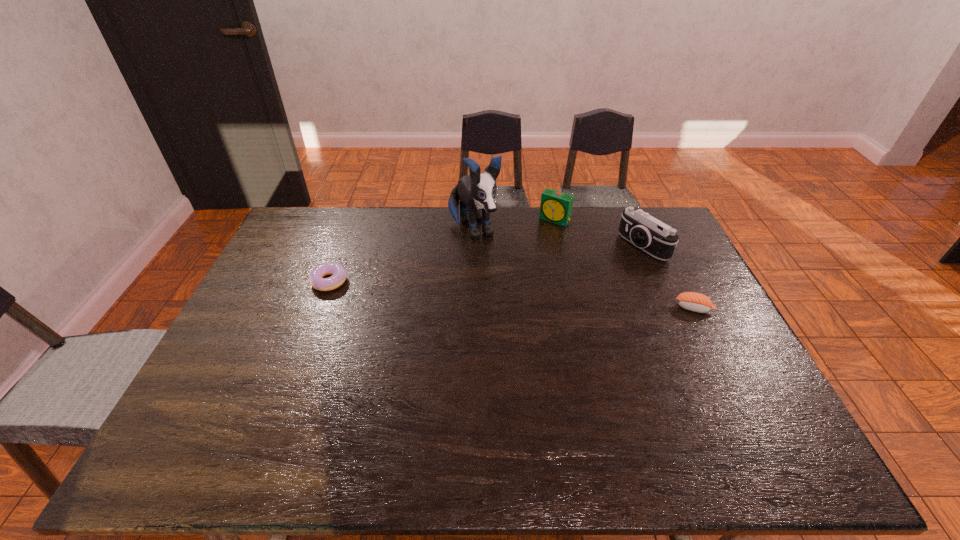
The height and width of the screenshot is (540, 960). I want to click on puppy at the far edge, so [x=477, y=191].

The height and width of the screenshot is (540, 960). What are the coordinates of `camera that is at the far edge` in the screenshot? It's located at (656, 238).

I want to click on alarm clock present at the far edge, so click(x=555, y=206).

This screenshot has width=960, height=540. Find the location of `sushi situated at the right edge`. sushi situated at the right edge is located at coordinates (693, 301).

Image resolution: width=960 pixels, height=540 pixels. What are the coordinates of `camera situated at the right edge` in the screenshot? It's located at (656, 238).

Where is `object that is at the far right corner`? object that is at the far right corner is located at coordinates (656, 238).

The width and height of the screenshot is (960, 540). I want to click on free point at the far edge, so click(x=572, y=214).

Locate an element on the screen. vacant point at the near edge is located at coordinates (347, 411).

In the image, there is a desktop. Where is `vacant space at the left edge`? Image resolution: width=960 pixels, height=540 pixels. vacant space at the left edge is located at coordinates (256, 386).

I want to click on blank space at the right edge, so click(717, 338).